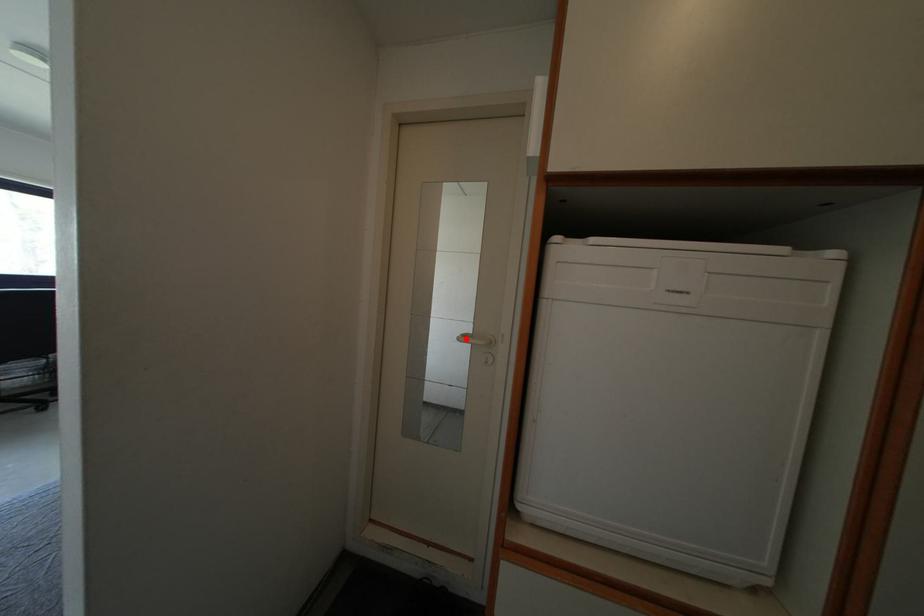
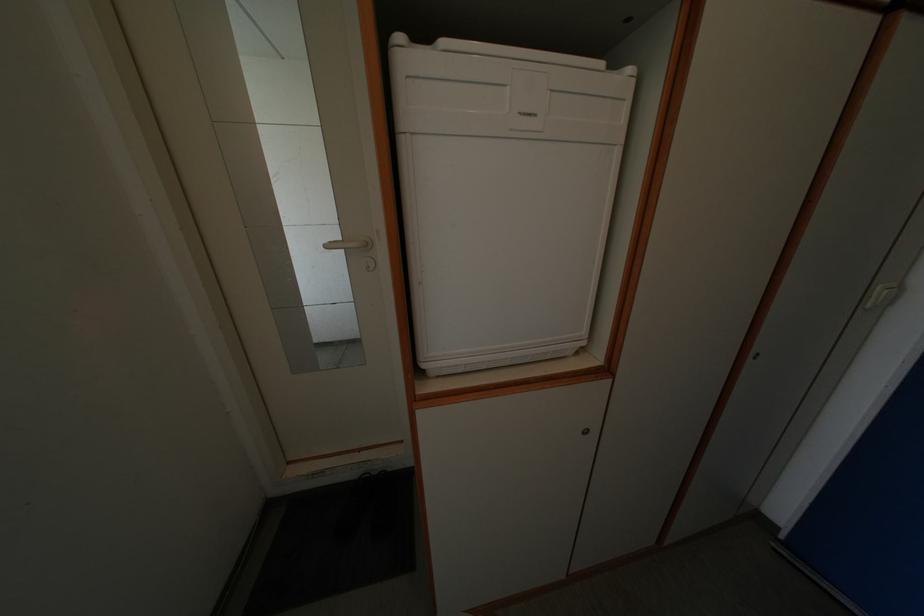
Question: I am providing you with two images of the same scene from different viewpoints. A red point is marked on the first image. Can you still see the location of the red point in image 2?

Choices:
 (A) Yes
 (B) No

Answer: (A)